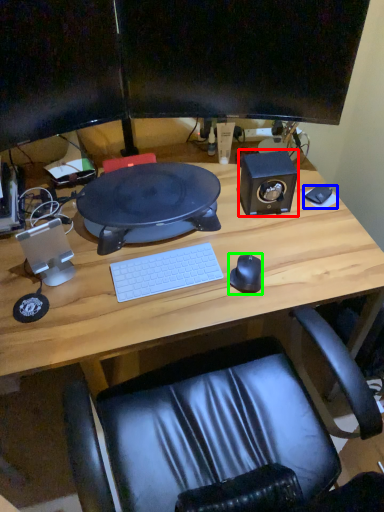
Question: Based on their relative distances, which object is farther from speaker (highlighted by a red box)? Choose from mousepad (highlighted by a blue box) and mouse (highlighted by a green box).

Choices:
 (A) mousepad
 (B) mouse

Answer: (B)